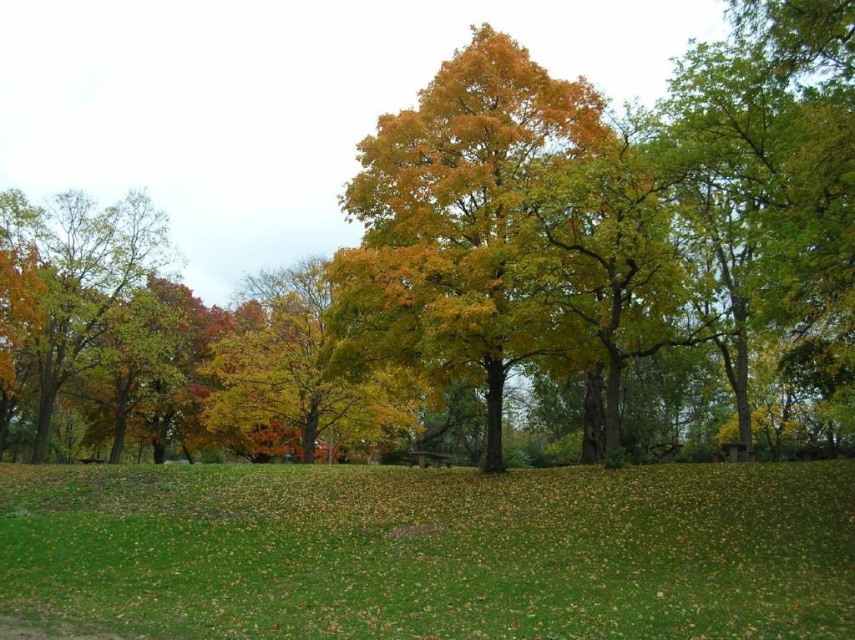
Question: Among these points, which one is farthest from the camera?

Choices:
 (A) (572, 120)
 (B) (795, 524)
 (C) (38, 458)

Answer: (C)

Question: Does green grassy field at lower center appear on the right side of yellow-green foliage at left?

Choices:
 (A) yes
 (B) no

Answer: (A)

Question: Which of the following is the closest to the observer?

Choices:
 (A) green grassy field at lower center
 (B) yellow-green foliage at left
 (C) yellow-green foliage at center

Answer: (A)

Question: Which of the following is the farthest from the observer?

Choices:
 (A) (491, 264)
 (B) (62, 262)

Answer: (B)

Question: Does green grassy field at lower center appear over yellow-green foliage at center?

Choices:
 (A) yes
 (B) no

Answer: (B)

Question: From the image, what is the correct spatial relationship of green grassy field at lower center in relation to yellow-green foliage at center?

Choices:
 (A) left
 (B) right

Answer: (A)